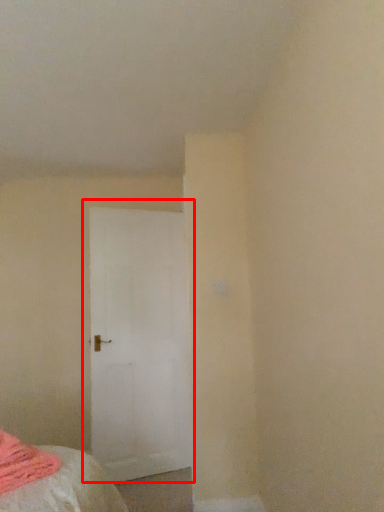
Question: From the image's perspective, what is the correct spatial relationship of door (annotated by the red box) in relation to blanket?

Choices:
 (A) above
 (B) below

Answer: (A)